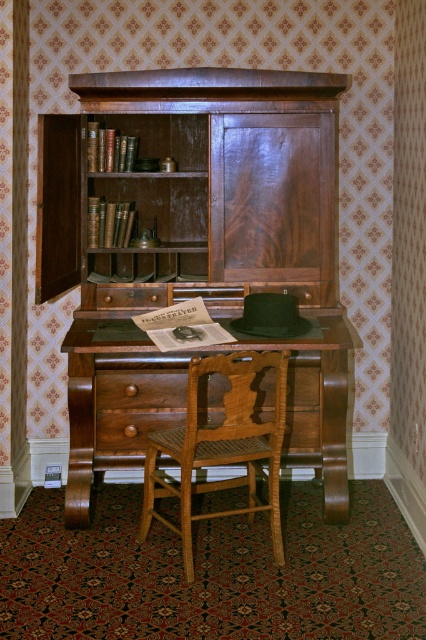
You are an interior designer planning to move a large potted plant between the mahogany wood bookcase at center and the wooden desk at center. The plant requires a minimum of 12 inches of space to be placed between them. Based on the scene, can the plant be accommodated in this location?

The mahogany wood bookcase at center is 14.02 inches from the wooden desk at center, which exceeds the required 12 inches of space. Therefore, the large potted plant can be accommodated between them.

You are standing in a room with a vintage desk and cabinet. There is a point marked at coordinates point (132,356). If you want to place a 3.5 meter long ladder horizontally from this point, will it fit in the room without touching any walls or furniture?

The distance from point (132,356) to the viewer is 3.55 meters. Since the ladder is 3.5 meters long, it will fit as it is slightly shorter than the available space.

You are standing in the room and want to place a new lamp on the wooden desk at center. Based on the desk location, where should you position yourself to place the lamp?

The wooden desk at center is located at point (115, 401), so you should position yourself near that coordinate to place the lamp.